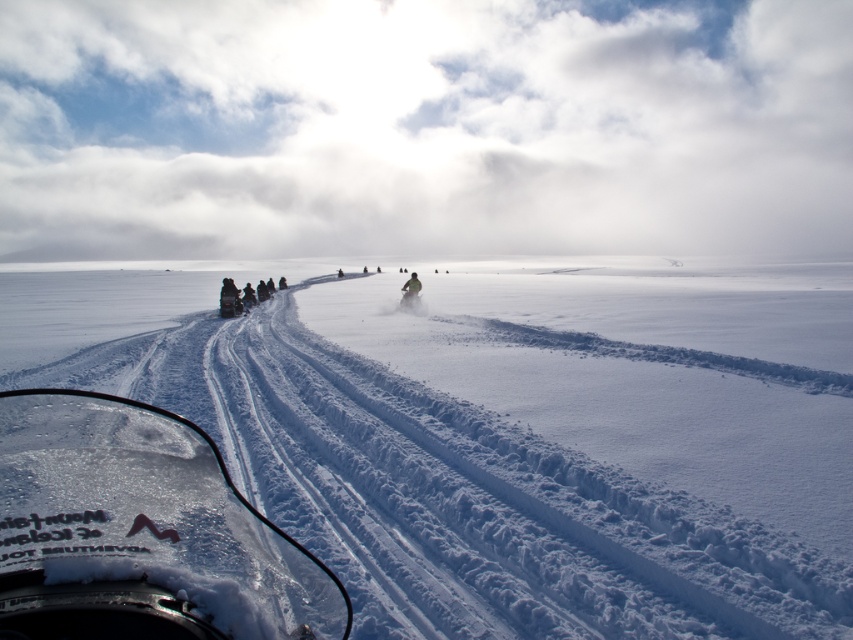
Question: Does clear plastic windshield at lower left appear under matte black snowmobile at center?

Choices:
 (A) no
 (B) yes

Answer: (B)

Question: Can you confirm if clear plastic windshield at lower left is smaller than matte black snowmobile at center?

Choices:
 (A) yes
 (B) no

Answer: (A)

Question: Among these objects, which one is nearest to the camera?

Choices:
 (A) clear plastic windshield at lower left
 (B) green matte snowmobile at center
 (C) green fabric jacket at center
 (D) matte black snowmobile at center

Answer: (A)

Question: Which point is closer to the camera?

Choices:
 (A) (399, 305)
 (B) (331, 307)
 (C) (416, 289)
 (D) (9, 524)

Answer: (D)

Question: Does white powdery snow at center appear under dark gray snowmobile at center?

Choices:
 (A) no
 (B) yes

Answer: (B)

Question: Which of the following is the closest to the observer?

Choices:
 (A) clear plastic windshield at lower left
 (B) dark gray snowmobile at center
 (C) matte black snowmobile at center

Answer: (A)